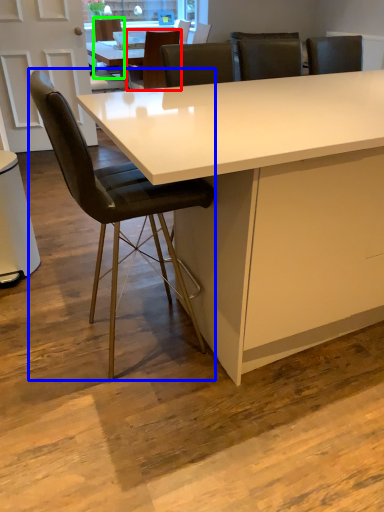
Question: Considering the real-world distances, which object is closest to chair (highlighted by a red box)? chair (highlighted by a blue box) or chair (highlighted by a green box).

Choices:
 (A) chair
 (B) chair

Answer: (B)